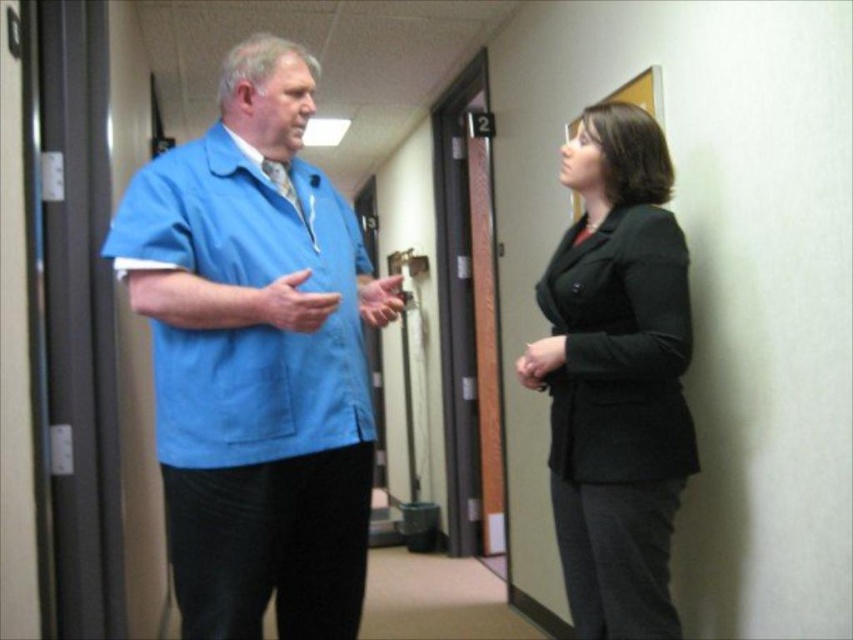
You are a delivery person carrying a box that is 24 inches wide. You need to walk through the hallway between the blue fabric shirt at center and the black matte blazer at right. Can you fit through the space without tilting the box?

The blue fabric shirt at center is 24.57 inches from the black matte blazer at right. Since the box is 24 inches wide, there is enough space to fit through without tilting the box.

You are a security guard who needs to approach both the blue fabric shirt at center and the black matte blazer at right. Which individual should you approach first based on their position in the hallway?

The blue fabric shirt at center is in front of the black matte blazer at right, so you should approach the blue fabric shirt at center first since it is closer to you.

You are a service robot with a height of 1.6 meters. You need to deliver a package to the person wearing the blue fabric shirt at center. The package is placed on a table 1.2 meters high. Can you reach the table to place the package without any assistance?

The blue fabric shirt at center is 1.43 meters away from the viewer. However, the question is about reaching the table height. Since the robot is 1.6 meters tall and the table is 1.2 meters high, the robot can easily reach the table to place the package without assistance.